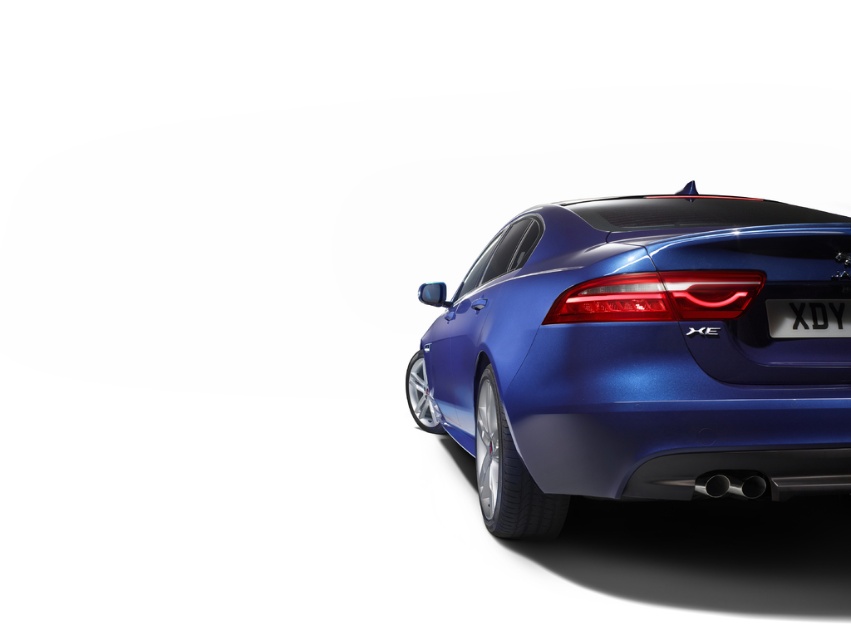
You are standing in front of the blue sedan and want to determine the position of two points on the car. The first point is located at coordinates point (629,273) and the second at point (792,308). Which point is closer to you?

Point (629,273) is closer to you than point (792,308) because it is further to the camera.

You are a car designer reviewing the rear design of the blue sedan. You notice the matte red tail light at center and the black plastic license plate at center. Which object is located to the left of the other?

The matte red tail light at center is positioned on the left side of black plastic license plate at center.

You are a photographer trying to capture the glossy metallic car at center and the matte red tail light at center in a single shot. Based on their positions, which object should you focus on first to ensure both are in frame?

The glossy metallic car at center is located above the matte red tail light at center, so you should focus on the glossy metallic car at center first to ensure both are in frame.